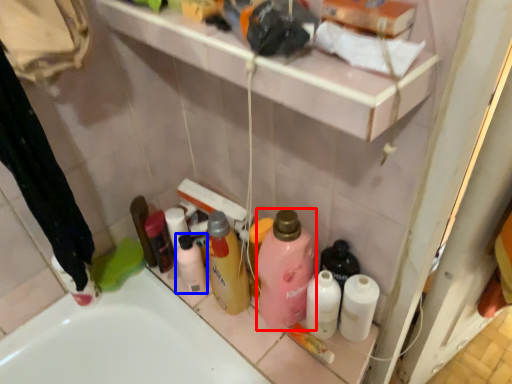
Question: Which object is closer to the camera taking this photo, cleaning product (highlighted by a red box) or toiletry (highlighted by a blue box)?

Choices:
 (A) cleaning product
 (B) toiletry

Answer: (A)